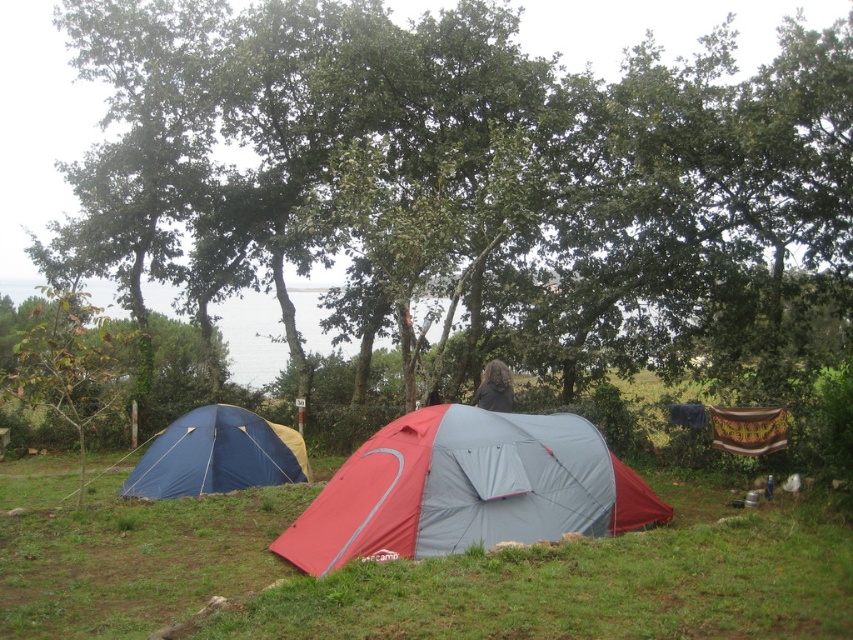
You are standing in the camping scene and want to reach the two points marked in the image. Which point, point (x=254, y=483) or point (x=509, y=403), will you reach first if you walk straight towards them?

Point (x=254, y=483) is closer to the viewer than point (x=509, y=403), so you will reach point (x=254, y=483) first.

You are a hiker who wants to take a photo of the green leafy tree at center and the dark brown hair at center. Which object should you focus on first if you want both to be in focus?

The dark brown hair at center is smaller than the green leafy tree at center, so you should focus on the green leafy tree at center first to ensure both are in focus.

You are standing at the camping site and want to reach a specific point marked at coordinates point (422, 492). If your maximum comfortable walking distance is 8 meters, can you comfortably reach that point without straining?

The distance of point (422, 492) from viewer is 7.99 meters, so yes, you can comfortably reach that point since it is within your 8 meters limit.